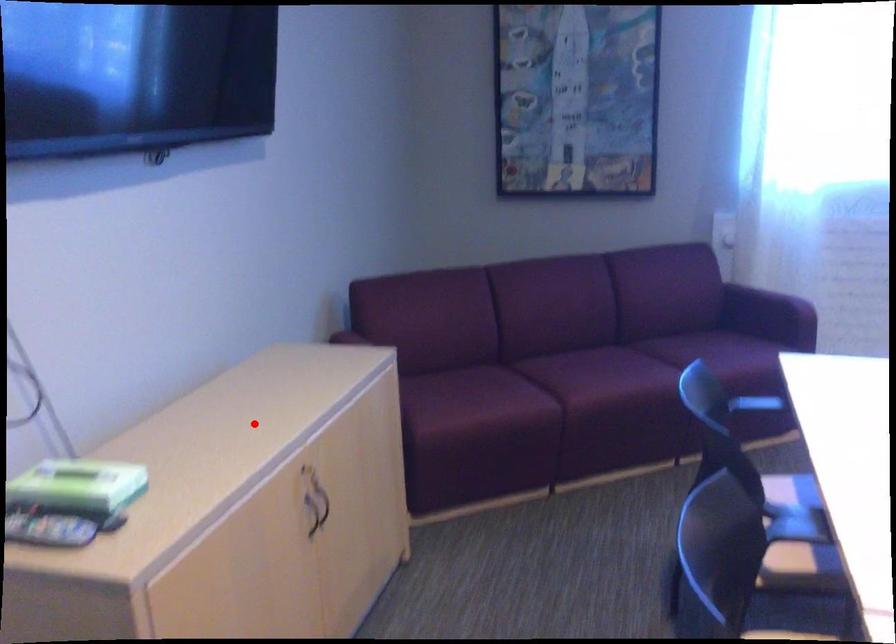
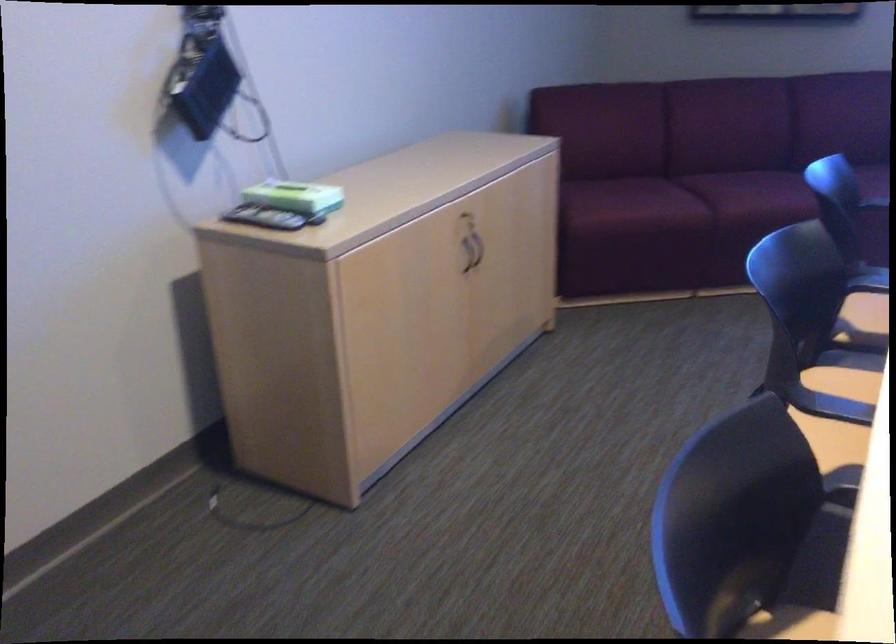
Question: I am providing you with two images of the same scene from different viewpoints. In image1, a red point is highlighted. Considering the same 3D point in image2, which of the following is correct?

Choices:
 (A) It is closer
 (B) It is farther

Answer: (B)